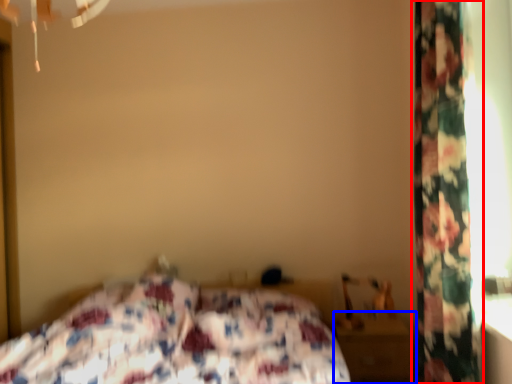
Question: Among these objects, which one is nearest to the camera, curtain (highlighted by a red box) or nightstand (highlighted by a blue box)?

Choices:
 (A) curtain
 (B) nightstand

Answer: (A)